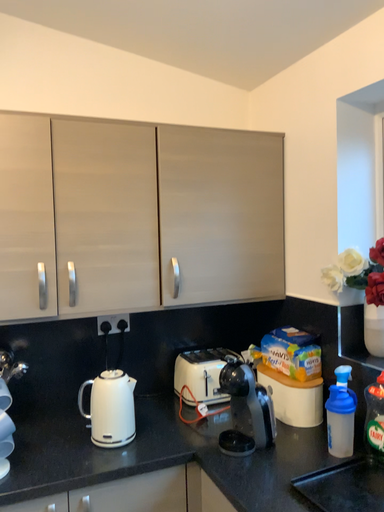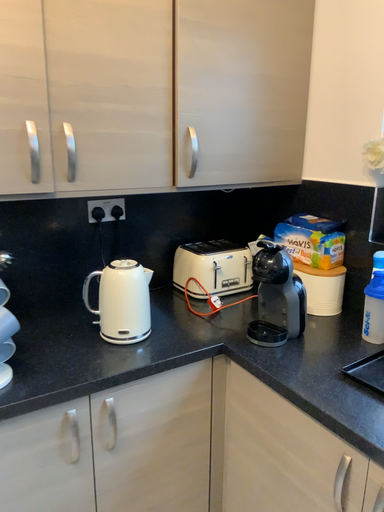
Question: Which way did the camera rotate in the video?

Choices:
 (A) rotated upward
 (B) rotated downward

Answer: (B)